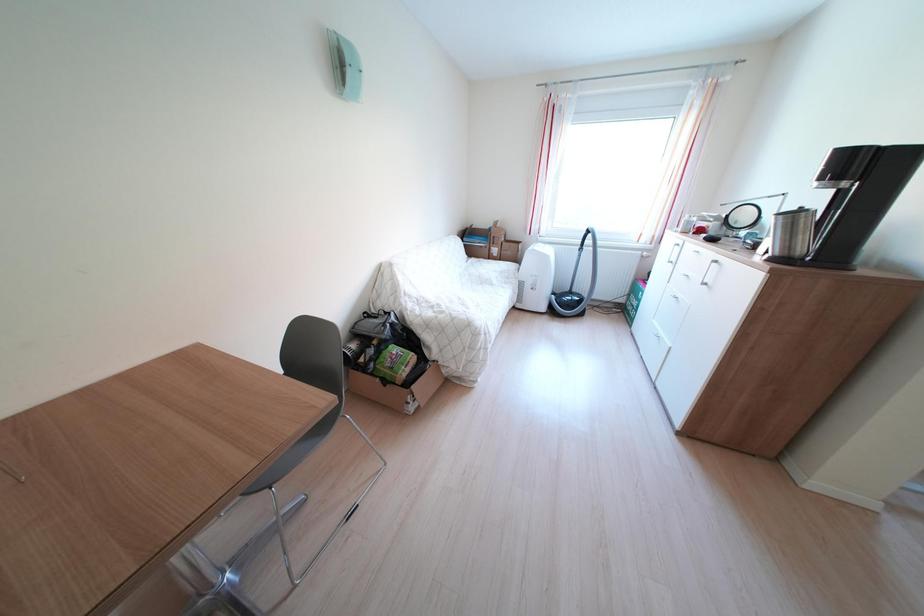
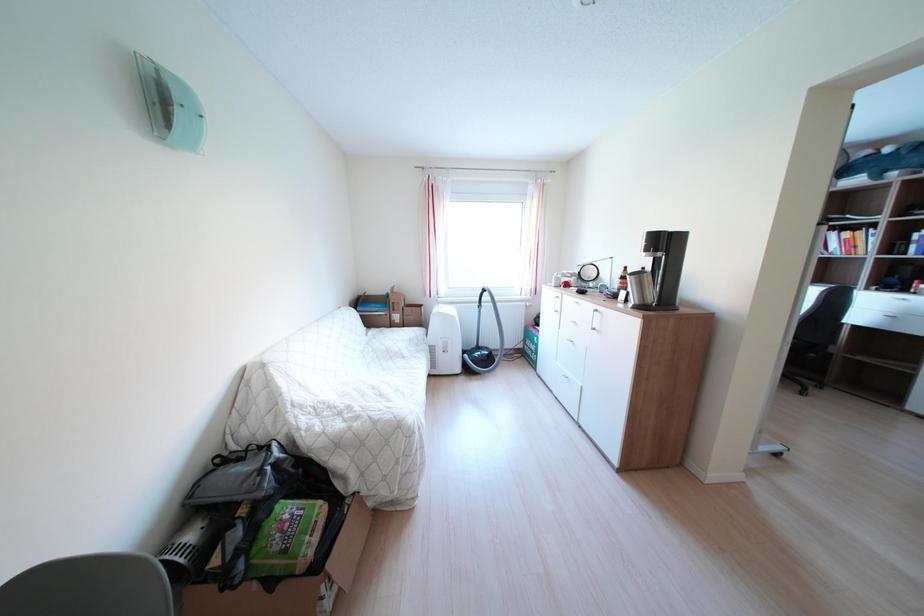
Question: The images are taken continuously from a first-person perspective. In which direction is your viewpoint rotating?

Choices:
 (A) Left
 (B) Right
 (C) Up
 (D) Down

Answer: (B)